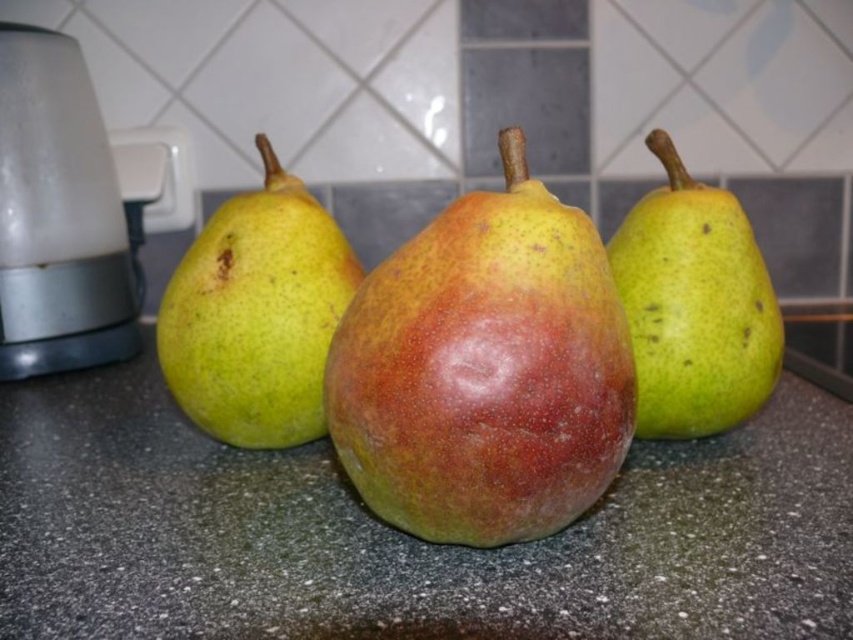
Question: Which of these objects is positioned closest to the green matte pear at center?

Choices:
 (A) speckled yellow-green pear at center
 (B) white plastic blender at left
 (C) speckled granite countertop at center

Answer: (C)

Question: Is green matte pear at center below green matte pear at right?

Choices:
 (A) yes
 (B) no

Answer: (A)

Question: In this image, where is speckled yellow-green pear at center located relative to green matte pear at center?

Choices:
 (A) left
 (B) right

Answer: (B)

Question: Among these points, which one is farthest from the camera?

Choices:
 (A) (202, 330)
 (B) (366, 561)

Answer: (A)

Question: Can you confirm if speckled granite countertop at center is positioned to the right of white plastic blender at left?

Choices:
 (A) yes
 (B) no

Answer: (A)

Question: Which of these objects is positioned closest to the green matte pear at right?

Choices:
 (A) green matte pear at center
 (B) speckled yellow-green pear at center

Answer: (B)